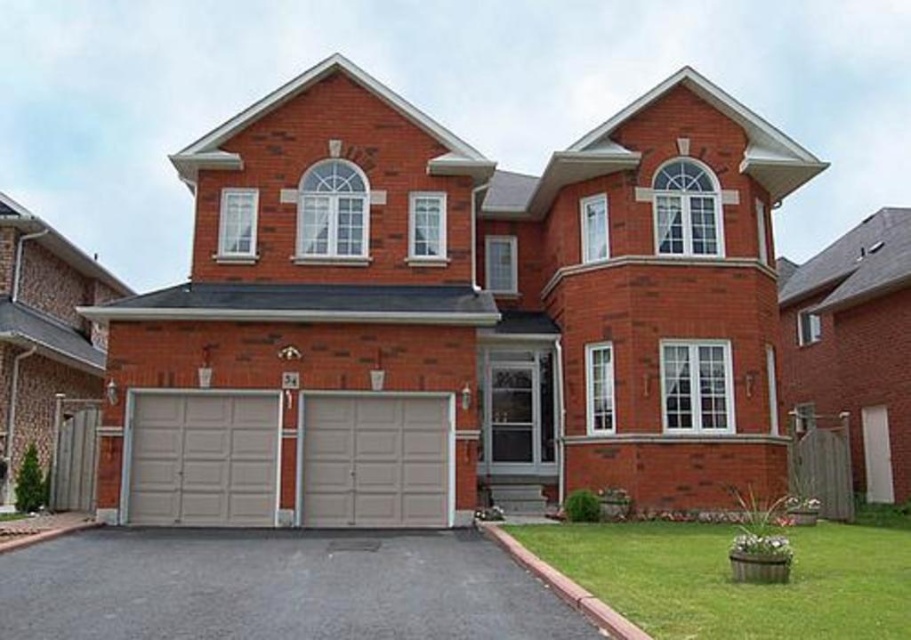
In the scene shown: You are a delivery person with a 10 feet wide truck. You need to park your truck between the black asphalt driveway at center and the green grass at lower right. Is there enough space for your truck to fit between them?

The black asphalt driveway at center and green grass at lower right are 11.09 feet apart from each other. Since your truck is 10 feet wide, there is enough space for it to fit between them as 11.09 feet is greater than 10 feet.

You are a delivery person approaching the house and need to park your van on the black asphalt driveway at center. However, there is a bicycle parked on the green grass at lower right. Can you park your van on the driveway without moving the bicycle?

The black asphalt driveway at center is to the left of green grass at lower right, so the driveway and the grass are separate areas. Since the bicycle is on the grass, you can park your van on the driveway without moving it.

You are planning to host a large outdoor event and need to determine where to place tents. Considering the black asphalt driveway at center and the green grass at lower right, which area can accommodate more tents based on their sizes?

The green grass at lower right is larger than the black asphalt driveway at center, so it can accommodate more tents.